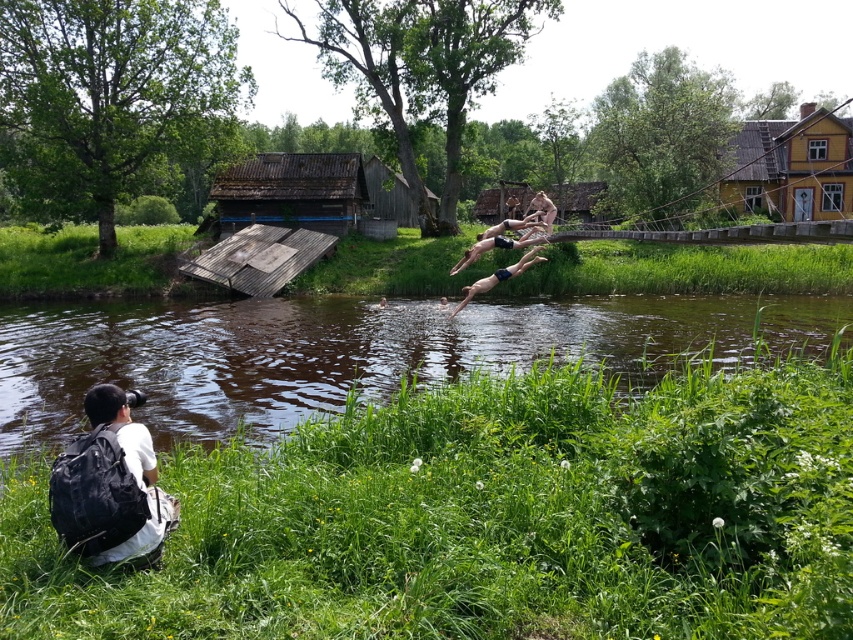
Question: Can you confirm if weathered wood hut at upper center is positioned below nude human at upper center?

Choices:
 (A) no
 (B) yes

Answer: (A)

Question: Which of the following is the farthest from the observer?

Choices:
 (A) (549, 227)
 (B) (479, 212)
 (C) (462, 326)

Answer: (B)

Question: Is black backpack at lower left to the right of smooth skin person at center from the viewer's perspective?

Choices:
 (A) no
 (B) yes

Answer: (A)

Question: Which of these objects is positioned farthest from the smooth skin divers at center?

Choices:
 (A) black backpack at lower left
 (B) wooden swing at upper center
 (C) smooth skin person at center
 (D) weathered wood hut at upper center

Answer: (B)

Question: Does brown murky water at center lie behind wooden swing at upper center?

Choices:
 (A) yes
 (B) no

Answer: (B)

Question: Estimate the real-world distances between objects in this image. Which object is farther from the brown murky water at center?

Choices:
 (A) smooth skin person at center
 (B) yellow wooden hut at upper right
 (C) weathered wood hut at upper center

Answer: (B)